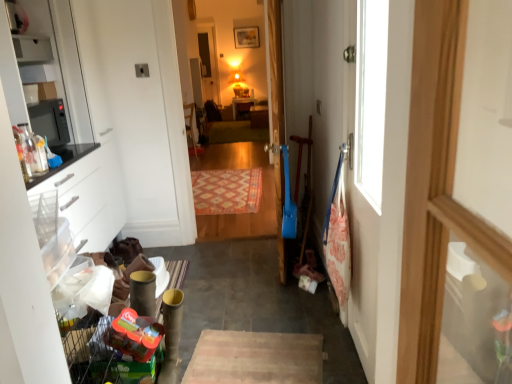
Where is `free region on the left part of blue plastic door at center`? free region on the left part of blue plastic door at center is located at coordinates pyautogui.click(x=230, y=264).